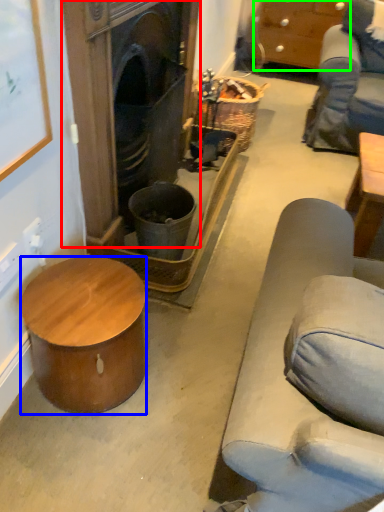
Question: Based on their relative distances, which object is nearer to fireplace (highlighted by a red box)? Choose from desk (highlighted by a blue box) and cabinetry (highlighted by a green box).

Choices:
 (A) desk
 (B) cabinetry

Answer: (A)